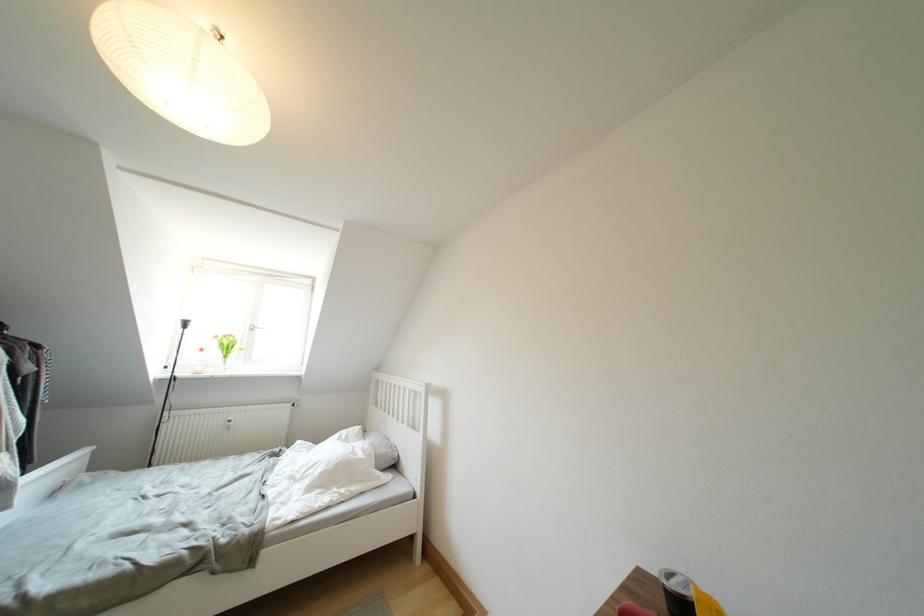
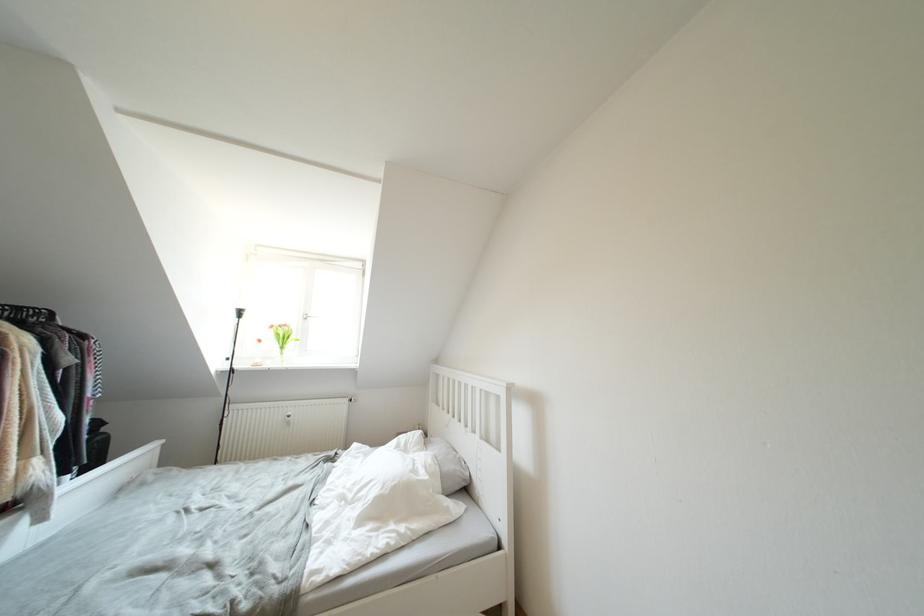
Question: Based on the continuous images, in which direction is the camera rotating? Reply with the corresponding letter.

Choices:
 (A) Left
 (B) Right
 (C) Up
 (D) Down

Answer: (A)